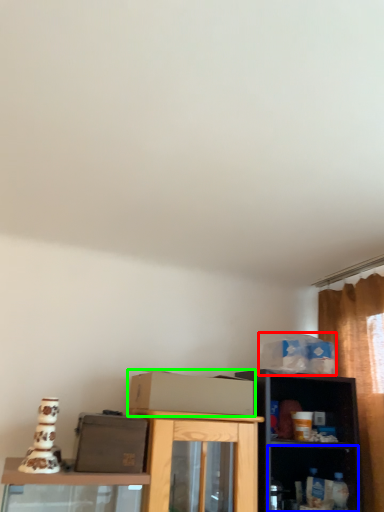
Question: Which object is positioned farthest from box (highlighted by a red box)? Select from shelf (highlighted by a blue box) and cardboard box (highlighted by a green box).

Choices:
 (A) shelf
 (B) cardboard box

Answer: (B)